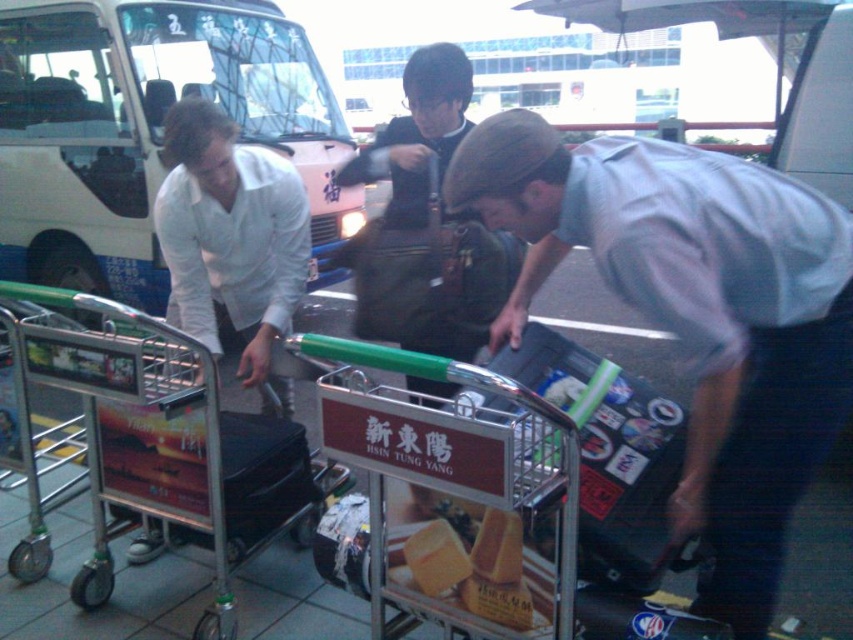
Question: Estimate the real-world distances between objects in this image. Which object is farther from the black leather suitcase at center?

Choices:
 (A) yellow matte bread at center
 (B) yellow sponge cake at center
 (C) pink matte bus at upper left

Answer: (C)

Question: Can you confirm if yellow sponge cake at center is positioned to the right of yellow matte bread at center?

Choices:
 (A) yes
 (B) no

Answer: (B)

Question: Is sticker-covered suitcase at center bigger than yellow matte bread at center?

Choices:
 (A) yes
 (B) no

Answer: (A)

Question: Considering the real-world distances, which object is farthest from the metallic silver trolley at center?

Choices:
 (A) sticker-covered suitcase at center
 (B) black leather suitcase at center
 (C) yellow sponge cake at center
 (D) matte gray shirt at center

Answer: (D)

Question: Is pink matte bus at upper left above yellow sponge cake at center?

Choices:
 (A) no
 (B) yes

Answer: (B)

Question: Which point is farther to the camera?

Choices:
 (A) black leather suitcase at center
 (B) yellow sponge cake at center
 (C) metallic silver trolley at center
 (D) yellow matte bread at center

Answer: (A)